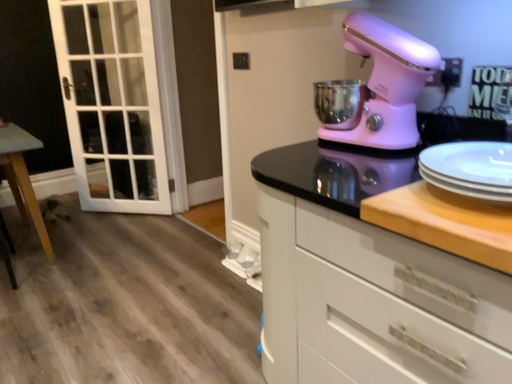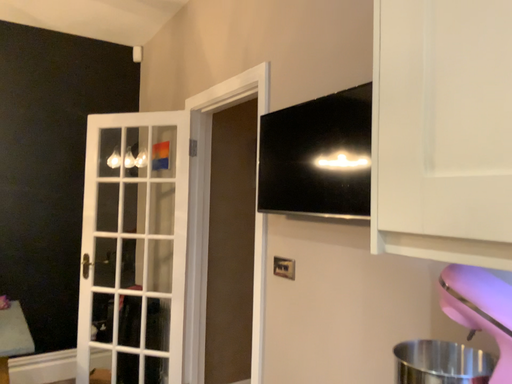
Question: Which way did the camera rotate in the video?

Choices:
 (A) rotated upward
 (B) rotated downward

Answer: (A)